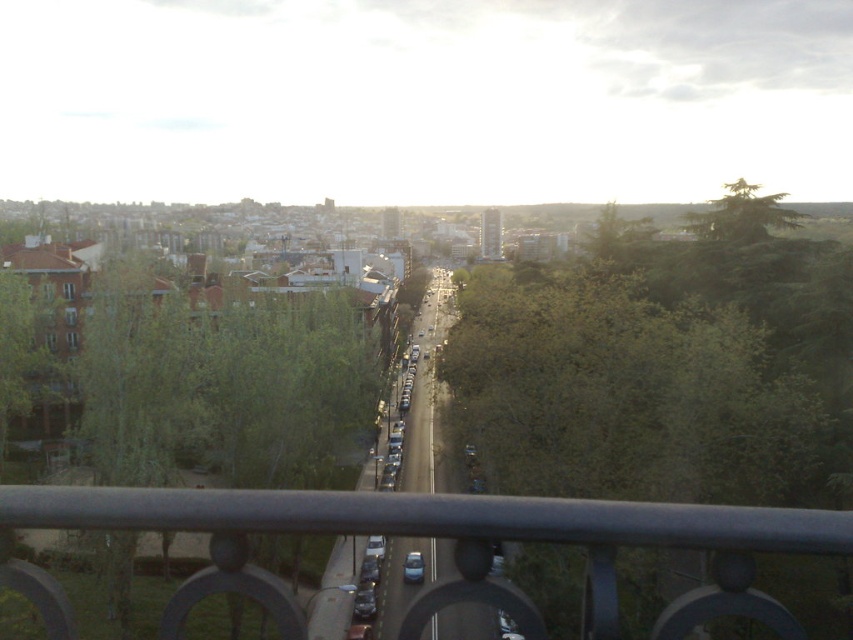
Question: Which of the following is the closest to the observer?

Choices:
 (A) (704, 225)
 (B) (515, 502)
 (C) (421, 556)
 (D) (538, 310)

Answer: (B)

Question: Which of the following is the closest to the observer?

Choices:
 (A) green leafy tree at upper right
 (B) green leafy tree at center
 (C) metallic gray railing at center

Answer: (C)

Question: Among these points, which one is farthest from the camera?

Choices:
 (A) (141, 525)
 (B) (628, 380)

Answer: (B)

Question: From the image, what is the correct spatial relationship of green leafy tree at center in relation to satin black car at center?

Choices:
 (A) below
 (B) above

Answer: (B)

Question: Does green leafy tree at upper right appear on the left side of satin black car at center?

Choices:
 (A) no
 (B) yes

Answer: (A)

Question: Is green leafy tree at upper right behind satin black car at center?

Choices:
 (A) yes
 (B) no

Answer: (A)